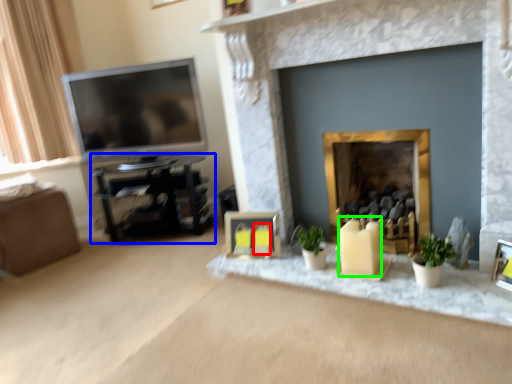
Question: Which is nearer to the candle (highlighted by a red box)? entertainment center (highlighted by a blue box) or candle (highlighted by a green box).

Choices:
 (A) entertainment center
 (B) candle

Answer: (B)